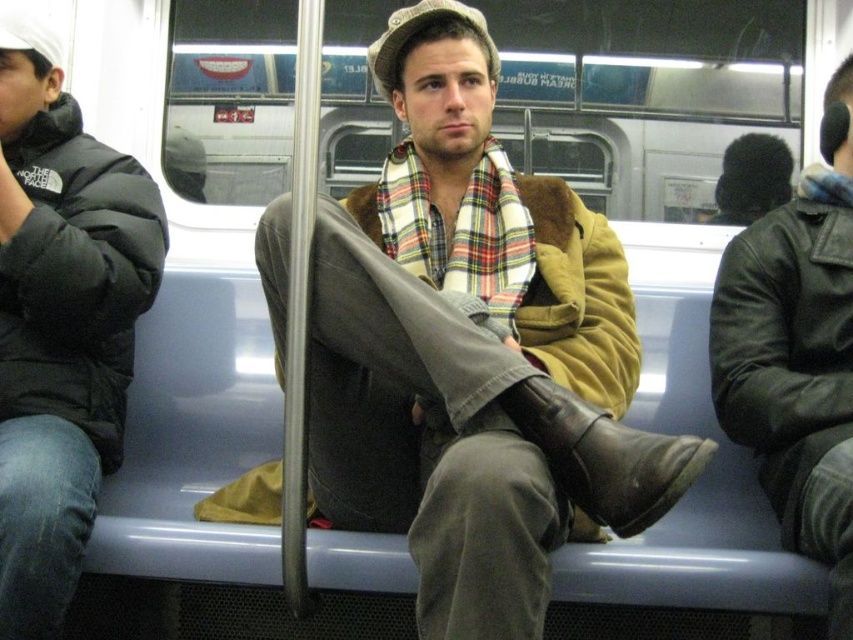
Question: Can you confirm if black puffy jacket at left is smaller than black fuzzy hat at upper right?

Choices:
 (A) no
 (B) yes

Answer: (A)

Question: Does brown fuzzy coat at center have a smaller size compared to leather jacket at right?

Choices:
 (A) yes
 (B) no

Answer: (B)

Question: Which point is closer to the camera taking this photo?

Choices:
 (A) (12, 266)
 (B) (440, 97)

Answer: (A)

Question: Which of the following is the closest to the observer?

Choices:
 (A) (846, 458)
 (B) (115, 163)
 (C) (775, 154)
 (D) (375, 64)

Answer: (A)

Question: Which point is farther to the camera?

Choices:
 (A) (619, 438)
 (B) (764, 134)
 (C) (13, 451)

Answer: (B)

Question: Can you confirm if black puffy jacket at left is positioned to the left of black fuzzy hat at upper right?

Choices:
 (A) yes
 (B) no

Answer: (A)